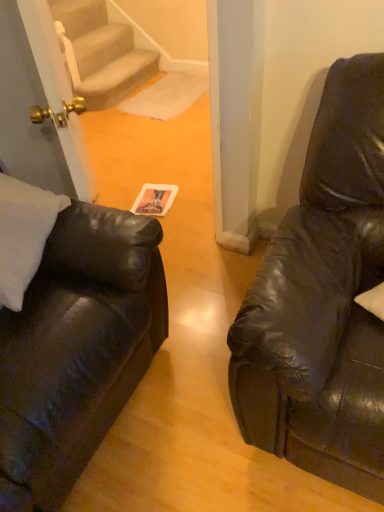
The height and width of the screenshot is (512, 384). What are the coordinates of `matte black couch at left` in the screenshot? It's located at pyautogui.click(x=70, y=335).

The height and width of the screenshot is (512, 384). What do you see at coordinates (70, 335) in the screenshot? I see `matte black couch at left` at bounding box center [70, 335].

What is the approximate width of matte black couch at left?

The width of matte black couch at left is 34.85 inches.

In order to click on matte black couch at left in this screenshot , I will do click(70, 335).